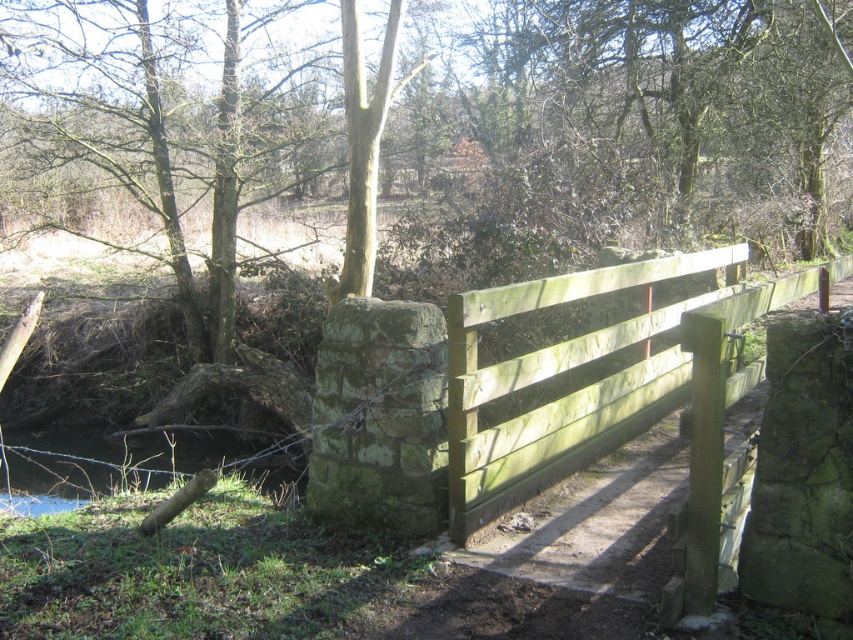
Based on the photo, you are a painter who wants to paint a landscape scene. You need to decide the order of painting elements based on their height. Which object should you paint first, the green painted wood fence at center or the green grassy river at lower left?

The green painted wood fence at center is taller than the green grassy river at lower left, so you should paint the green painted wood fence at center first to ensure proper layering.

You are standing at the entrance of the scene and want to find the green painted wood fence at center. Based on the coordinates provided, in which direction should you look to locate it?

The green painted wood fence at center is located at coordinates point (x=566, y=372), which is to the right and slightly below the center of the scene.